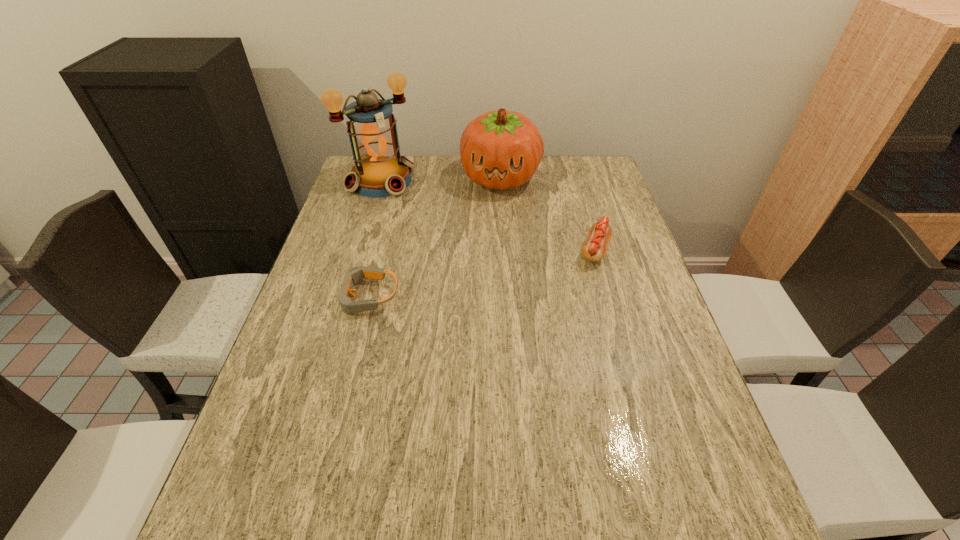
Identify which object is the second closest to the third object from left to right. Please provide its 2D coordinates. Your answer should be formatted as a tuple, i.e. [(x, y)], where the tuple contains the x and y coordinates of a point satisfying the conditions above.

[(594, 249)]

You are a GUI agent. You are given a task and a screenshot of the screen. Output one action in this format:
    pyautogui.click(x=<x>, y=<y>)
    Task: Click on the free location that satisfies the following two spatial constraints: 1. on the front side of the third tallest object; 2. on the right side of the pumpkin
    This screenshot has width=960, height=540.
    Given the screenshot: What is the action you would take?
    pyautogui.click(x=505, y=250)